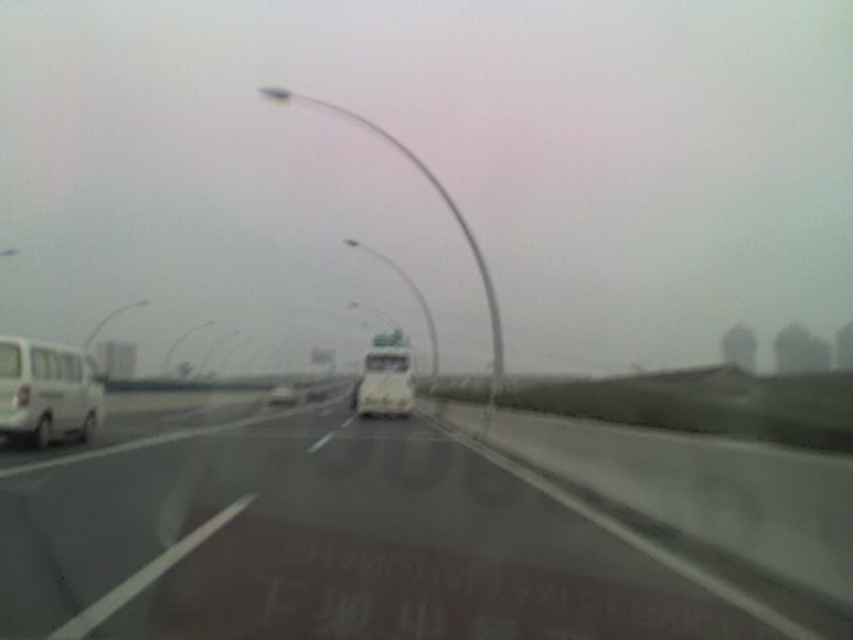
Does white glossy highway at center have a lesser height compared to white matte van at center?

Indeed, white glossy highway at center has a lesser height compared to white matte van at center.

Who is shorter, white glossy highway at center or white matte van at center?

white glossy highway at center is shorter.

Is point (345, 449) in front of point (271, 390)?

Yes.

Where is `white glossy highway at center`? This screenshot has width=853, height=640. white glossy highway at center is located at coordinates (347, 541).

Who is more distant from viewer, (57, 435) or (401, 358)?

The point (401, 358) is behind.

Is point (7, 401) closer to camera compared to point (374, 372)?

Yes, it is.

I want to click on white matte van at left, so click(x=47, y=392).

The height and width of the screenshot is (640, 853). Identify the location of white matte van at left. (47, 392).

At what (x,y) coordinates should I click in order to perform the action: click on white glossy highway at center. Please return your answer as a coordinate pair (x, y). Looking at the image, I should click on (347, 541).

Is white glossy highway at center further to the viewer compared to white matte bus at center?

No, white glossy highway at center is closer to the viewer.

Find the location of a particular element. This screenshot has width=853, height=640. white glossy highway at center is located at coordinates (347, 541).